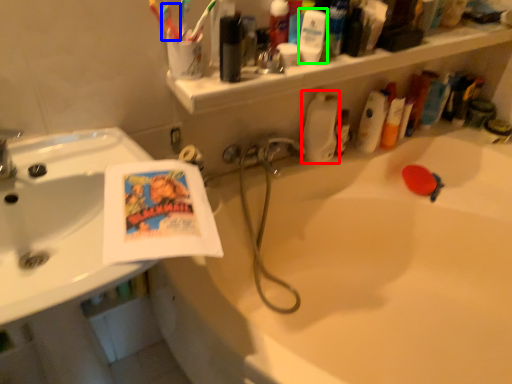
Question: Which is nearer to the cleaning product (highlighted by a red box)? toothbrush (highlighted by a blue box) or mouthwash (highlighted by a green box).

Choices:
 (A) toothbrush
 (B) mouthwash

Answer: (B)